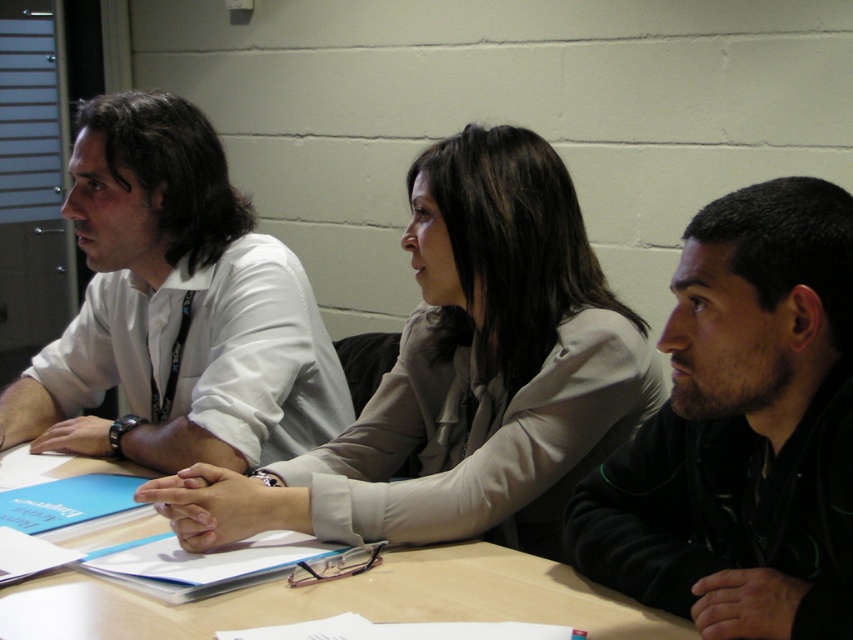
Between light beige fabric jacket at center and wooden table at center, which one is positioned higher?

light beige fabric jacket at center is higher up.

Does light beige fabric jacket at center have a smaller size compared to wooden table at center?

Incorrect, light beige fabric jacket at center is not smaller in size than wooden table at center.

Describe the element at coordinates (462, 376) in the screenshot. The height and width of the screenshot is (640, 853). I see `light beige fabric jacket at center` at that location.

Find the location of `light beige fabric jacket at center`. light beige fabric jacket at center is located at coordinates (462, 376).

Based on the photo, does dark brown hair at center appear over wooden table at center?

Yes, dark brown hair at center is above wooden table at center.

Where is `dark brown hair at center`? The image size is (853, 640). dark brown hair at center is located at coordinates (741, 429).

Which is behind, point (248, 368) or point (631, 637)?

The point (248, 368) is more distant.

Is white shirt at center further to camera compared to wooden table at center?

Yes, it is behind wooden table at center.

Does point (282, 310) come behind point (381, 593)?

Yes, point (282, 310) is farther from viewer.

Image resolution: width=853 pixels, height=640 pixels. Identify the location of white shirt at center. (177, 308).